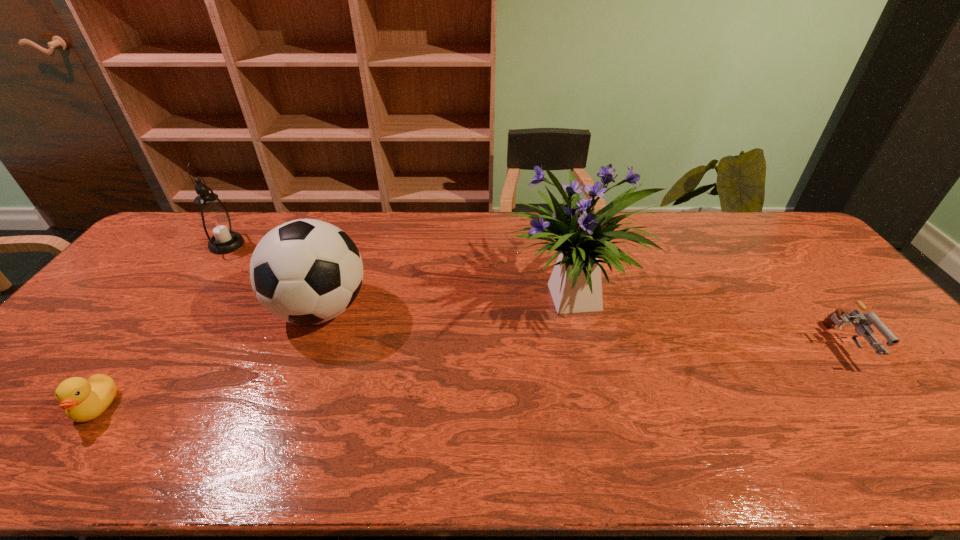
Find the location of a particular element. empty space between the rightmost object and the oil lamp is located at coordinates (533, 295).

Where is `free space between the tallest object and the farthest object`? The height and width of the screenshot is (540, 960). free space between the tallest object and the farthest object is located at coordinates (399, 272).

Where is `free spot between the soccer ball and the flower arrangement`? free spot between the soccer ball and the flower arrangement is located at coordinates (446, 305).

Locate an element on the screen. Image resolution: width=960 pixels, height=540 pixels. free spot between the farthest object and the duck is located at coordinates (161, 326).

Find the location of a particular element. free spot between the rightmost object and the soccer ball is located at coordinates (580, 327).

Locate an element on the screen. The image size is (960, 540). blank region between the oil lamp and the tallest object is located at coordinates (399, 272).

Identify the location of free space between the duck and the farthest object. The width and height of the screenshot is (960, 540). (161, 326).

Choose which object is the second nearest neighbor to the shortest object. Please provide its 2D coordinates. Your answer should be formatted as a tuple, i.e. [(x, y)], where the tuple contains the x and y coordinates of a point satisfying the conditions above.

[(215, 222)]

Identify which object is the second closest to the tallest object. Please provide its 2D coordinates. Your answer should be formatted as a tuple, i.e. [(x, y)], where the tuple contains the x and y coordinates of a point satisfying the conditions above.

[(863, 321)]

Find the location of a particular element. vacant position in the image that satisfies the following two spatial constraints: 1. on the front side of the oil lamp; 2. on the right side of the fourth object from left to right is located at coordinates (187, 300).